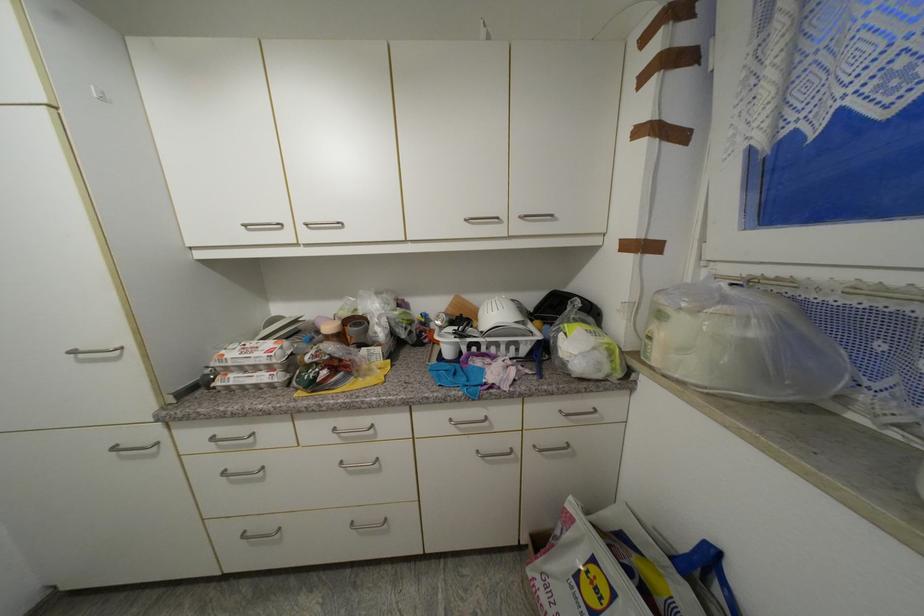
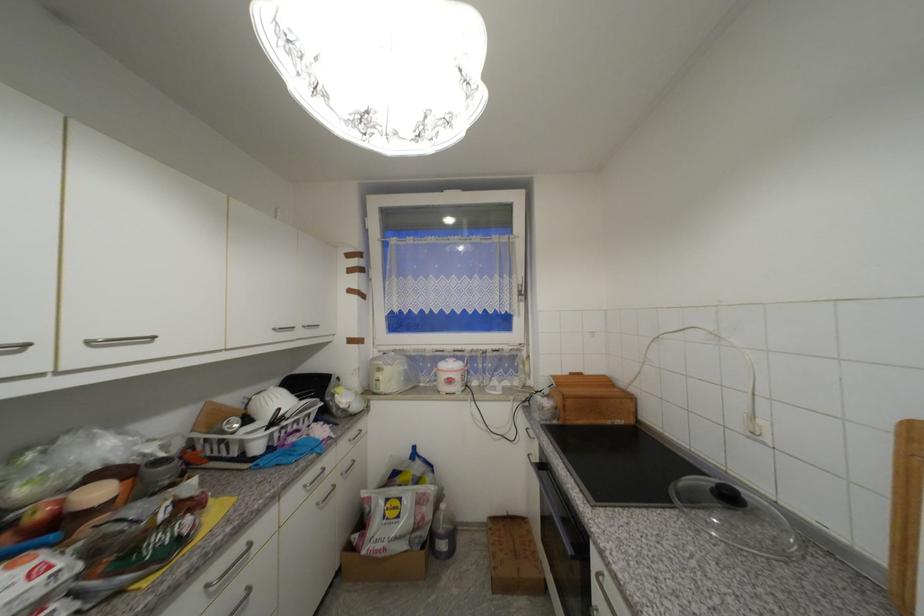
The point at (470, 222) is marked in the first image. Where is the corresponding point in the second image?

(281, 331)